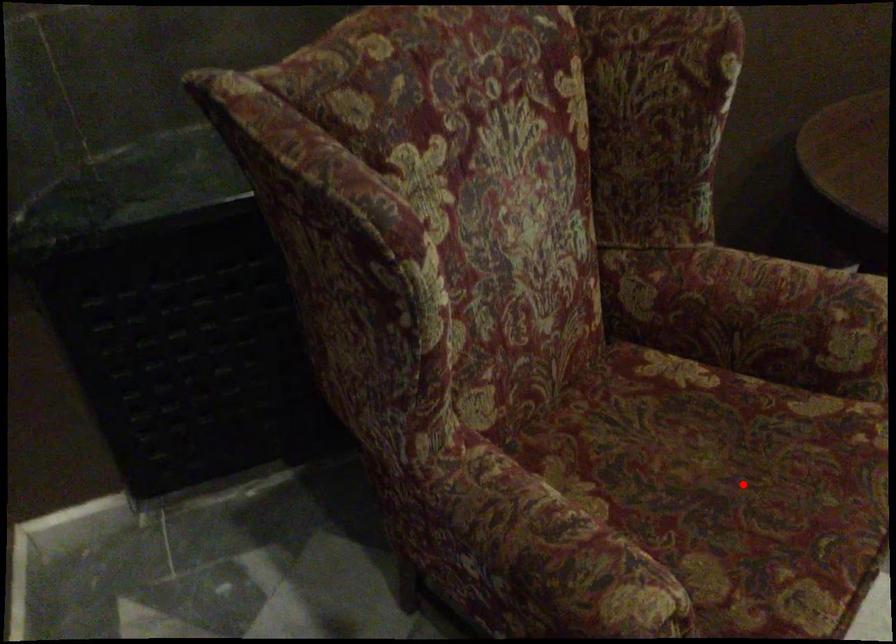
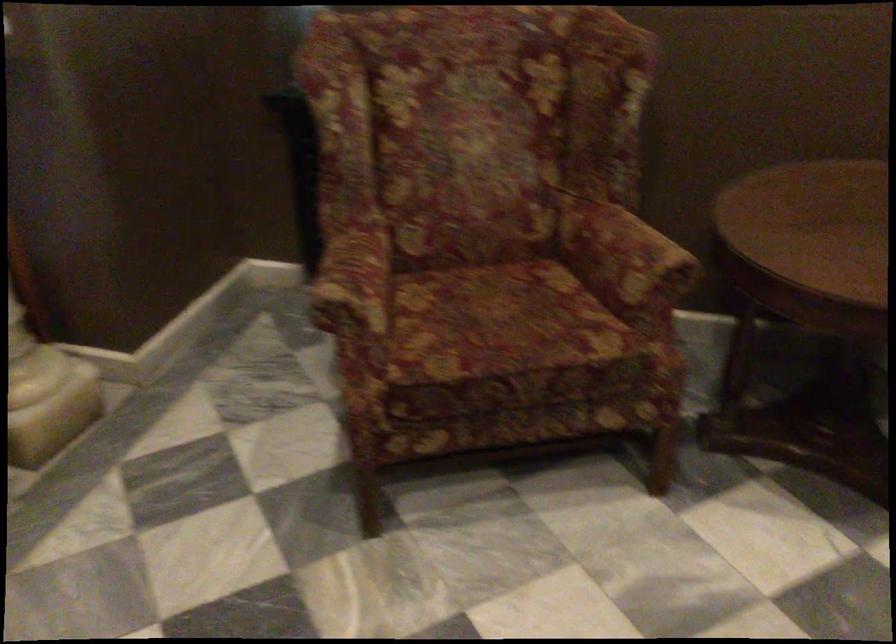
Question: I am providing you with two images of the same scene from different viewpoints. A red point is shown in image1. For the corresponding object point in image2, is it positioned nearer or farther from the camera?

Choices:
 (A) Nearer
 (B) Farther

Answer: (B)